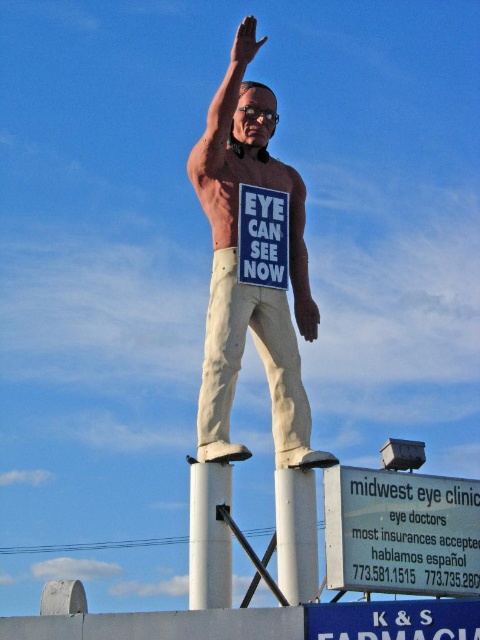
Between matte orange shirt at center and white matte signboard at center, which one is positioned lower?

white matte signboard at center

Can you confirm if matte orange shirt at center is wider than white matte signboard at center?

Yes.

At what (x,y) coordinates should I click in order to perform the action: click on matte orange shirt at center. Please return your answer as a coordinate pair (x, y). Looking at the image, I should click on (236, 269).

Does matte orange shirt at center appear under white painted metal pole at center?

No, matte orange shirt at center is not below white painted metal pole at center.

Between matte orange shirt at center and white painted metal pole at center, which one appears on the right side from the viewer's perspective?

matte orange shirt at center

Who is more distant from viewer, (284, 440) or (230, 596)?

Point (284, 440)

Identify the location of matte orange shirt at center. (236, 269).

Who is lower down, white plastic sign at lower right or white smooth pole at lower center?

white smooth pole at lower center is lower down.

Between point (422, 504) and point (294, 499), which one is positioned in front?

Point (422, 504) is in front.

You are a GUI agent. You are given a task and a screenshot of the screen. Output one action in this format:
    pyautogui.click(x=<x>, y=<y>)
    Task: Click on the white plastic sign at lower right
    This screenshot has width=480, height=640.
    Given the screenshot: What is the action you would take?
    pyautogui.click(x=400, y=532)